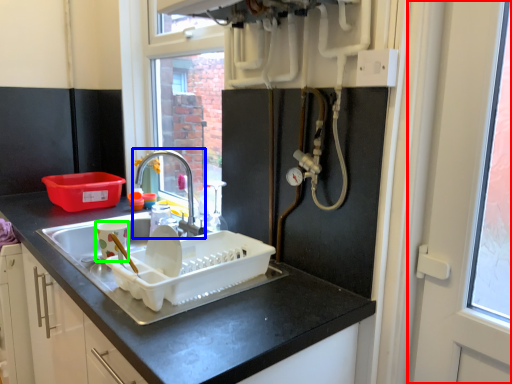
Question: Estimate the real-world distances between objects in this image. Which object is farther from screen door (highlighted by a red box), tap (highlighted by a blue box) or appliance (highlighted by a green box)?

Choices:
 (A) tap
 (B) appliance

Answer: (A)